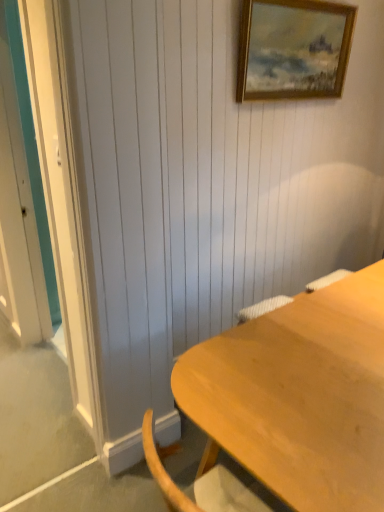
Question: Does light wood desk at lower right have a greater width compared to gold-framed painting at upper center?

Choices:
 (A) no
 (B) yes

Answer: (B)

Question: From the image's perspective, does light wood desk at lower right appear lower than gold-framed painting at upper center?

Choices:
 (A) yes
 (B) no

Answer: (A)

Question: Is gold-framed painting at upper center at the back of light wood desk at lower right?

Choices:
 (A) yes
 (B) no

Answer: (B)

Question: Does light wood desk at lower right appear on the left side of gold-framed painting at upper center?

Choices:
 (A) yes
 (B) no

Answer: (A)

Question: From a real-world perspective, is light wood desk at lower right located higher than gold-framed painting at upper center?

Choices:
 (A) yes
 (B) no

Answer: (B)

Question: Is light wood desk at lower right positioned behind gold-framed painting at upper center?

Choices:
 (A) no
 (B) yes

Answer: (A)

Question: Does gold-framed painting at upper center have a lesser width compared to light wood desk at lower right?

Choices:
 (A) no
 (B) yes

Answer: (B)

Question: From the image's perspective, is gold-framed painting at upper center beneath light wood desk at lower right?

Choices:
 (A) yes
 (B) no

Answer: (B)

Question: Is light wood desk at lower right surrounded by gold-framed painting at upper center?

Choices:
 (A) yes
 (B) no

Answer: (B)

Question: Is gold-framed painting at upper center further to camera compared to light wood desk at lower right?

Choices:
 (A) no
 (B) yes

Answer: (B)

Question: Is gold-framed painting at upper center facing away from light wood desk at lower right?

Choices:
 (A) yes
 (B) no

Answer: (B)

Question: Considering the relative sizes of gold-framed painting at upper center and light wood desk at lower right in the image provided, is gold-framed painting at upper center shorter than light wood desk at lower right?

Choices:
 (A) no
 (B) yes

Answer: (B)

Question: Looking at their shapes, would you say light wood desk at lower right is wider or thinner than gold-framed painting at upper center?

Choices:
 (A) wide
 (B) thin

Answer: (A)